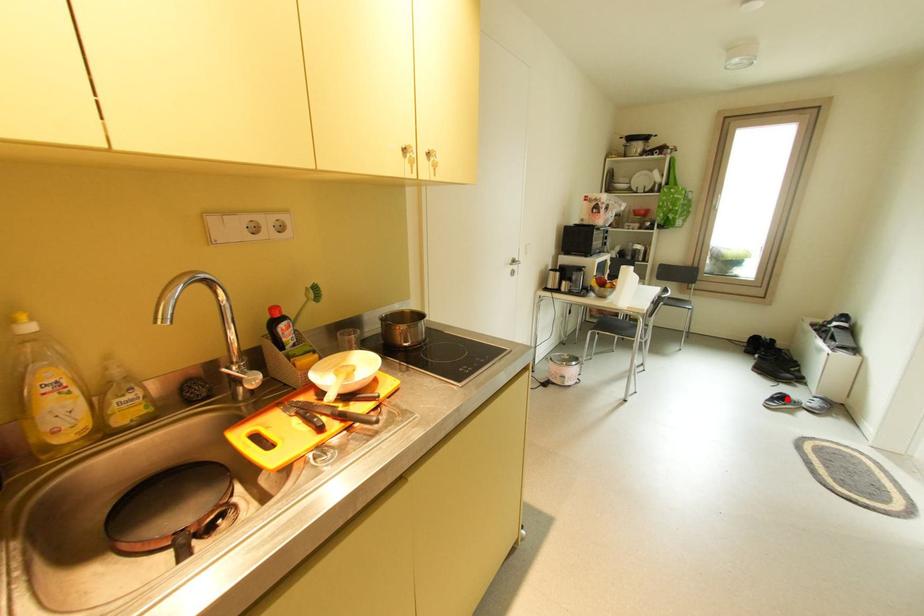
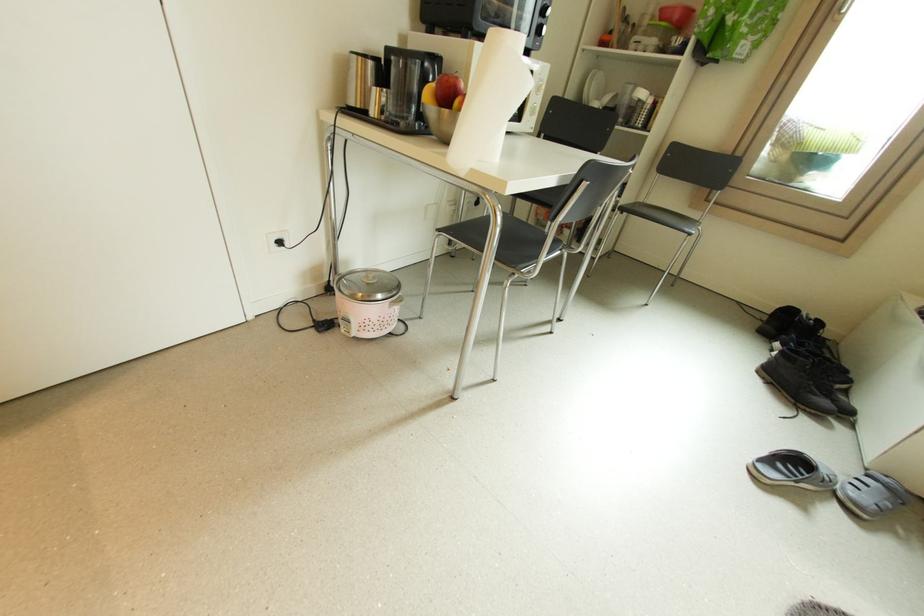
Where in the second image is the point corresponding to the highlighted location from the first image?

(799, 463)